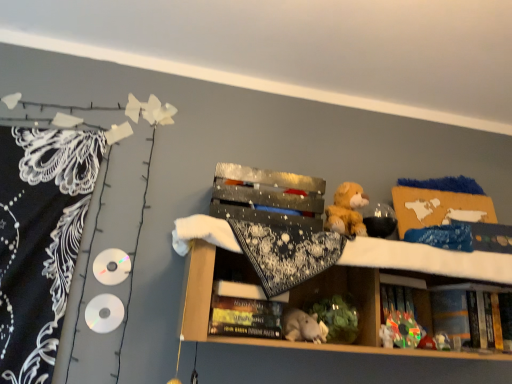
Question: Considering the relative sizes of white plush toy at center, which is the third toy from top to bottom, and hardcover book at center, the 2th book viewed from the back, in the image provided, is white plush toy at center, which is the third toy from top to bottom, smaller than hardcover book at center, the 2th book viewed from the back,?

Choices:
 (A) yes
 (B) no

Answer: (A)

Question: Is white plush toy at center, acting as the 2th toy starting from the right, outside of hardcover book at center, the 2th book viewed from the back?

Choices:
 (A) yes
 (B) no

Answer: (A)

Question: Is white plush toy at center, acting as the 2th toy starting from the right, at the left side of hardcover book at center, the first book from the left?

Choices:
 (A) yes
 (B) no

Answer: (B)

Question: Can you confirm if white plush toy at center, which ranks as the first toy in bottom-to-top order, is thinner than hardcover book at center, the first book from the left?

Choices:
 (A) no
 (B) yes

Answer: (B)

Question: From the image's perspective, does white plush toy at center, which is the third toy from top to bottom, appear higher than hardcover book at center, acting as the first book starting from the front?

Choices:
 (A) no
 (B) yes

Answer: (A)

Question: Would you say hardcover book at center, the 2th book viewed from the back, is part of white plush toy at center, acting as the 2th toy starting from the right,'s contents?

Choices:
 (A) no
 (B) yes

Answer: (A)

Question: Is shiny metallic box at center surrounding plush toy at center, which is counted as the 3th toy, starting from the left?

Choices:
 (A) yes
 (B) no

Answer: (A)

Question: Is shiny metallic box at center next to plush toy at center, which is the 2th toy from top to bottom?

Choices:
 (A) yes
 (B) no

Answer: (B)

Question: Is shiny metallic box at center at the left side of plush toy at center, which is the 2th toy from top to bottom?

Choices:
 (A) no
 (B) yes

Answer: (B)

Question: Considering the relative sizes of shiny metallic box at center and plush toy at center, acting as the 2th toy starting from the bottom, in the image provided, is shiny metallic box at center wider than plush toy at center, acting as the 2th toy starting from the bottom,?

Choices:
 (A) no
 (B) yes

Answer: (B)

Question: Is shiny metallic box at center thinner than plush toy at center, which is the 2th toy from top to bottom?

Choices:
 (A) no
 (B) yes

Answer: (A)

Question: From a real-world perspective, is shiny metallic box at center on top of plush toy at center, acting as the 2th toy starting from the bottom?

Choices:
 (A) yes
 (B) no

Answer: (A)

Question: From the image's perspective, does black lace blanket at left appear higher than plush toy at center, which is the 2th toy from top to bottom?

Choices:
 (A) yes
 (B) no

Answer: (A)